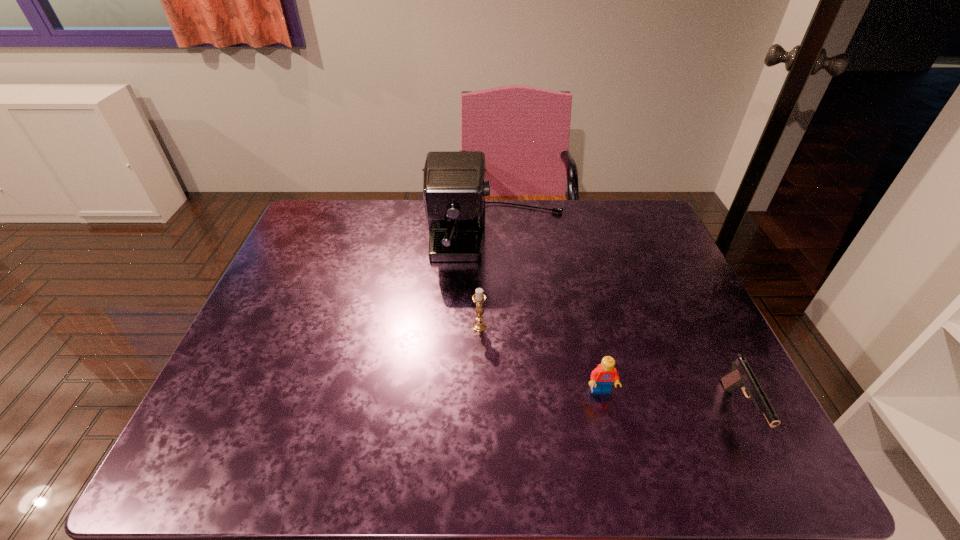
I want to click on object present at the far edge, so click(454, 186).

Find the location of a particular element. This screenshot has height=540, width=960. object positioned at the near edge is located at coordinates (741, 376).

Where is `object that is at the right edge`? The width and height of the screenshot is (960, 540). object that is at the right edge is located at coordinates (x=741, y=376).

Locate an element on the screen. This screenshot has width=960, height=540. object situated at the near right corner is located at coordinates (741, 376).

At what (x,y) coordinates should I click in order to perform the action: click on vacant space at the far edge of the desktop. Please return your answer as a coordinate pair (x, y). The image size is (960, 540). Looking at the image, I should click on (373, 213).

Where is `vacant region at the near edge of the desktop`? vacant region at the near edge of the desktop is located at coordinates (392, 441).

At what (x,y) coordinates should I click in order to perform the action: click on vacant space at the left edge of the desktop. Please return your answer as a coordinate pair (x, y). This screenshot has width=960, height=540. Looking at the image, I should click on (263, 382).

In the image, there is a desktop. Where is `vacant space at the right edge`? The width and height of the screenshot is (960, 540). vacant space at the right edge is located at coordinates (657, 263).

Find the location of a particular element. This screenshot has width=960, height=540. vacant area at the far left corner is located at coordinates pos(324,233).

This screenshot has height=540, width=960. In the image, there is a desktop. Identify the location of free space at the far right corner. (618, 214).